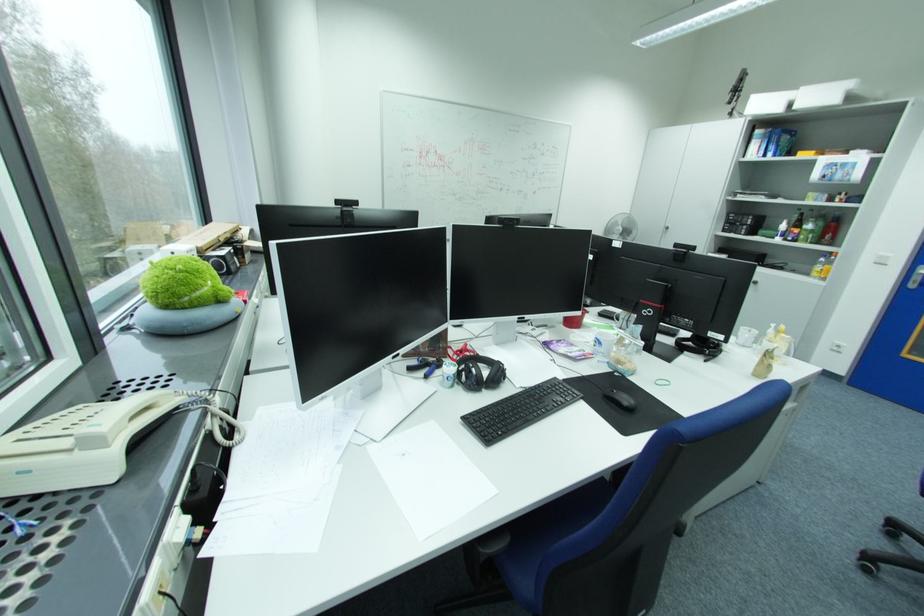
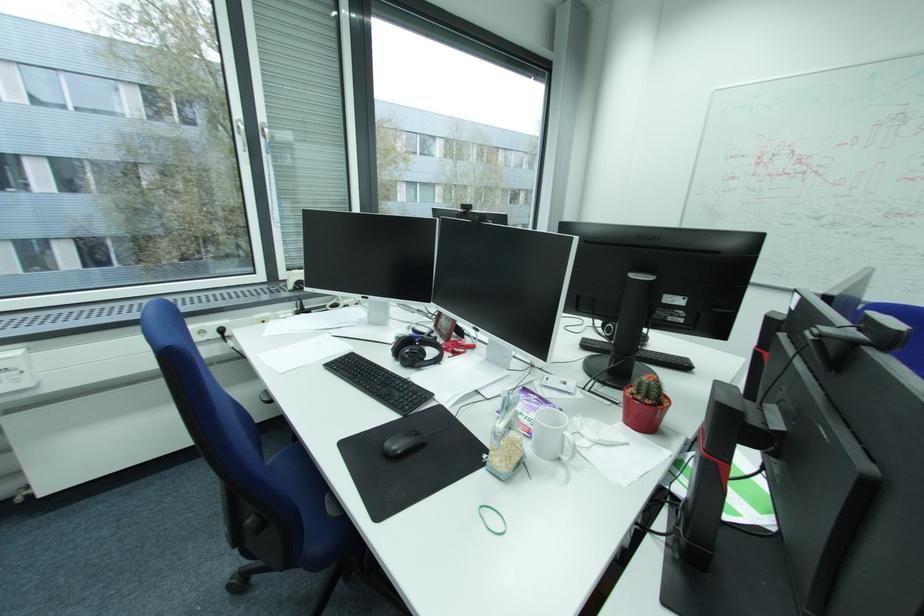
Locate, in the second image, the point that corresponds to the point at 581,331 in the first image.

(629, 424)